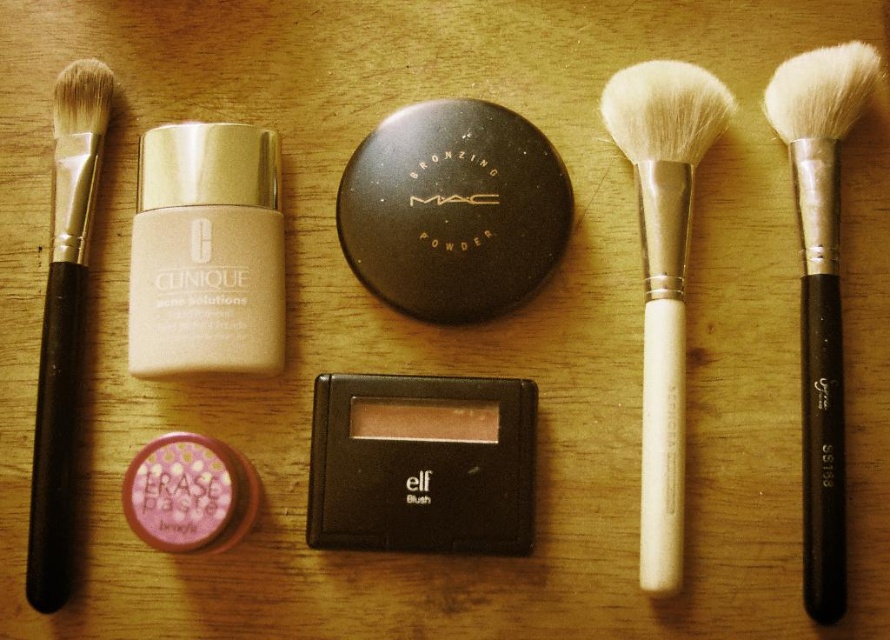
You are a photographer adjusting the focus on your camera. You notice two points in the scene at coordinates point [803,182] and point [99,109]. Which point should you focus on first if you want to ensure both points are in focus without moving the camera?

You should focus on point [803,182] first because it is closer to the camera than point [99,109], allowing the depth of field to cover both points effectively.

You are a makeup artist preparing to place a new lipstick tube, which is 8 cm in height, between the matte cream foundation at upper left and the shiny pink eraser paste at bottom left. Based on their heights, can the lipstick tube fit vertically between them without exceeding the space?

The matte cream foundation at upper left is much taller than the shiny pink eraser paste at bottom left. Since the lipstick tube is 8 cm in height, it might not fit vertically between them if the vertical space between the two items is less than 8 cm. However, the exact vertical distance isn